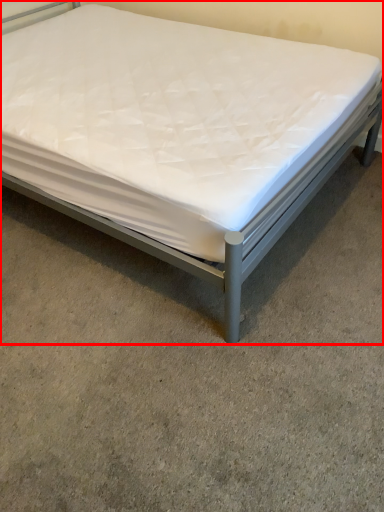
Question: From the image's perspective, considering the relative positions of bed (annotated by the red box) and concrete in the image provided, where is bed (annotated by the red box) located with respect to the staircase?

Choices:
 (A) below
 (B) above

Answer: (B)